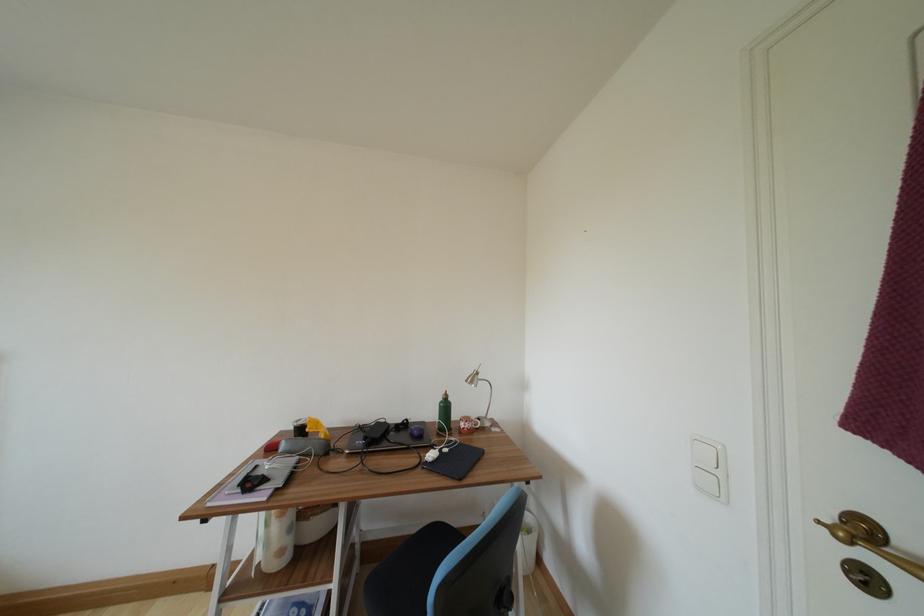
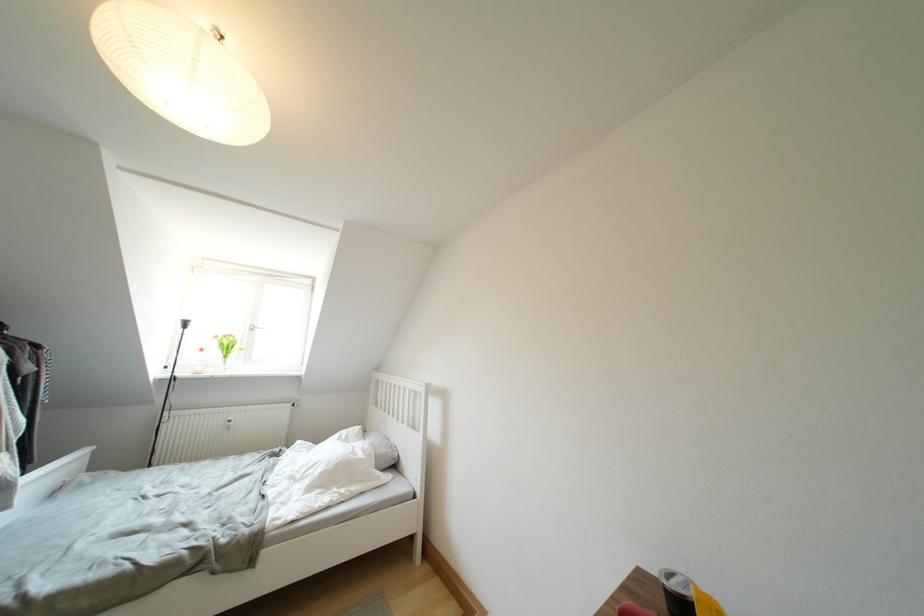
Find the pixel in the second image that matches [305,427] in the first image.

(678, 589)